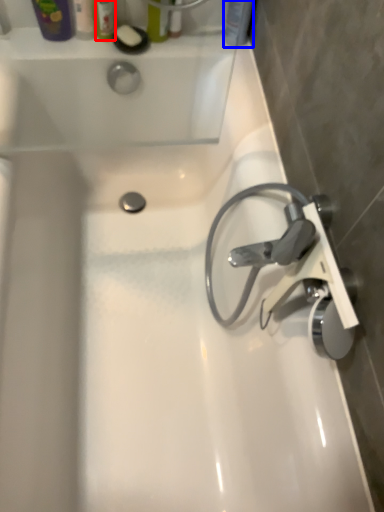
Question: Which point is further to the camera, toiletry (highlighted by a red box) or toiletry (highlighted by a blue box)?

Choices:
 (A) toiletry
 (B) toiletry

Answer: (B)